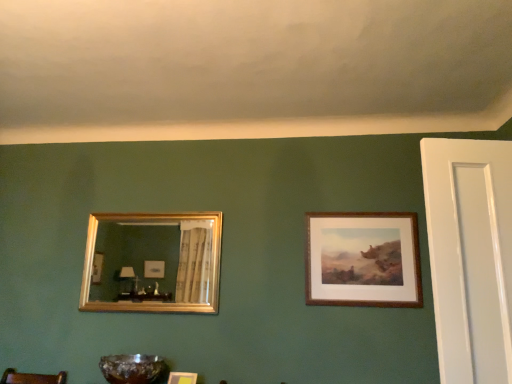
Question: Is point (168, 380) closer or farther from the camera than point (326, 253)?

Choices:
 (A) closer
 (B) farther

Answer: (A)

Question: In terms of width, does wooden picture frame at lower center, which is the 2th picture frame from left to right, look wider or thinner when compared to brown wooden frame at upper right, marked as the third picture frame in a left-to-right arrangement?

Choices:
 (A) thin
 (B) wide

Answer: (B)

Question: Considering the real-world distances, which object is closest to the gold-framed mirror at left, which is the first picture frame from left to right?

Choices:
 (A) brown wooden frame at upper right, the first picture frame positioned from the right
 (B) wooden picture frame at lower center, which is counted as the second picture frame, starting from the right
 (C) translucent amber glass bowl at lower center

Answer: (C)

Question: Estimate the real-world distances between objects in this image. Which object is farther from the translucent amber glass bowl at lower center?

Choices:
 (A) wooden picture frame at lower center, which is the 2th picture frame from left to right
 (B) gold-framed mirror at left, the 3th picture frame in the right-to-left sequence
 (C) brown wooden frame at upper right, the first picture frame positioned from the right

Answer: (B)